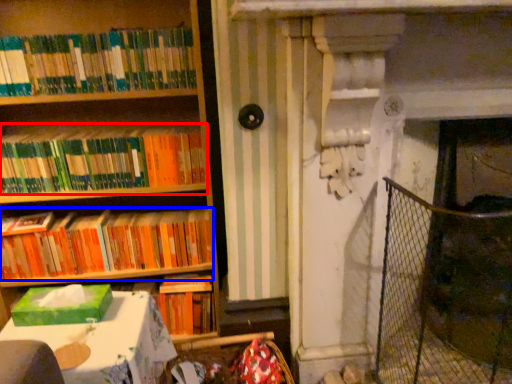
Question: Among these objects, which one is nearest to the camera, book (highlighted by a red box) or book (highlighted by a blue box)?

Choices:
 (A) book
 (B) book

Answer: (A)